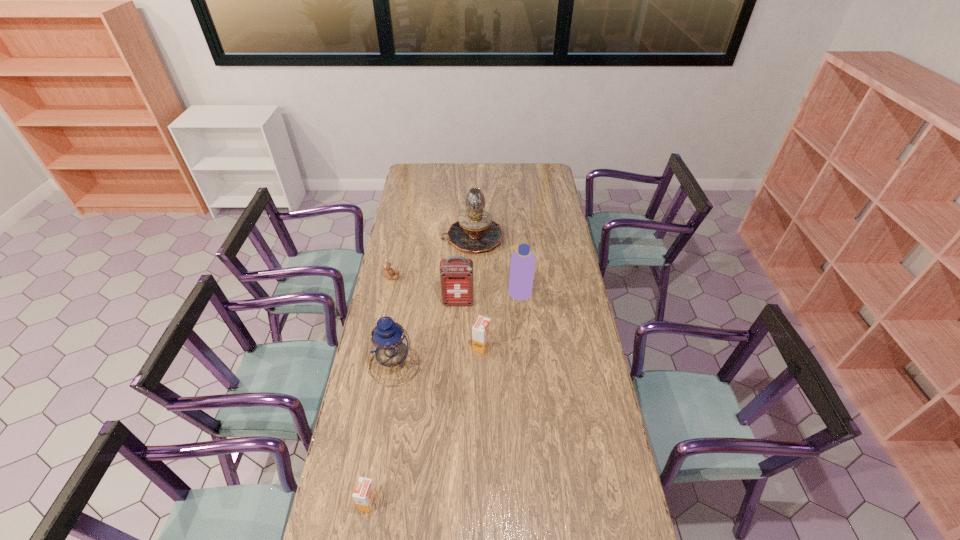
What are the coordinates of `vacant space that's between the oil lamp and the right orange juice` in the screenshot? It's located at (477, 292).

This screenshot has height=540, width=960. In order to click on vacant area that lies between the first-aid kit and the shampoo in this screenshot , I will do `click(489, 297)`.

Locate an element on the screen. unoccupied position between the shortest object and the first-aid kit is located at coordinates (424, 290).

The image size is (960, 540). I want to click on free space that is in between the second shortest object and the oil lamp, so click(x=420, y=370).

The height and width of the screenshot is (540, 960). In order to click on free spot between the shorter orange juice and the oil lamp in this screenshot , I will do `click(420, 370)`.

Find the location of a particular element. The image size is (960, 540). free space between the lantern and the first-aid kit is located at coordinates (426, 334).

Identify the location of object that stands as the sixth closest to the shortest object. (365, 494).

Select which object appears as the sixth closest to the shortest object. Please provide its 2D coordinates. Your answer should be formatted as a tuple, i.e. [(x, y)], where the tuple contains the x and y coordinates of a point satisfying the conditions above.

[(365, 494)]

Identify the location of blank space that satisfies the following two spatial constraints: 1. on the face of the taller orange juice; 2. on the left side of the shortest object. (377, 346).